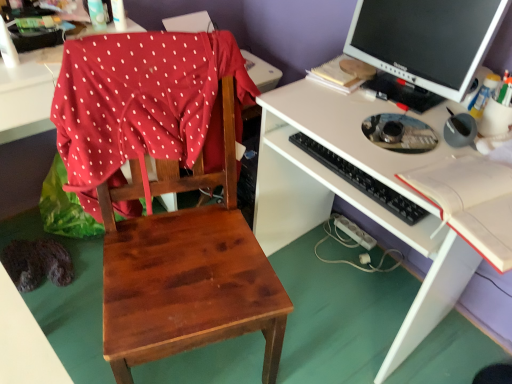
Find the location of `free space above white matte desk at center (from a real-world perspective)`. free space above white matte desk at center (from a real-world perspective) is located at coordinates (388, 121).